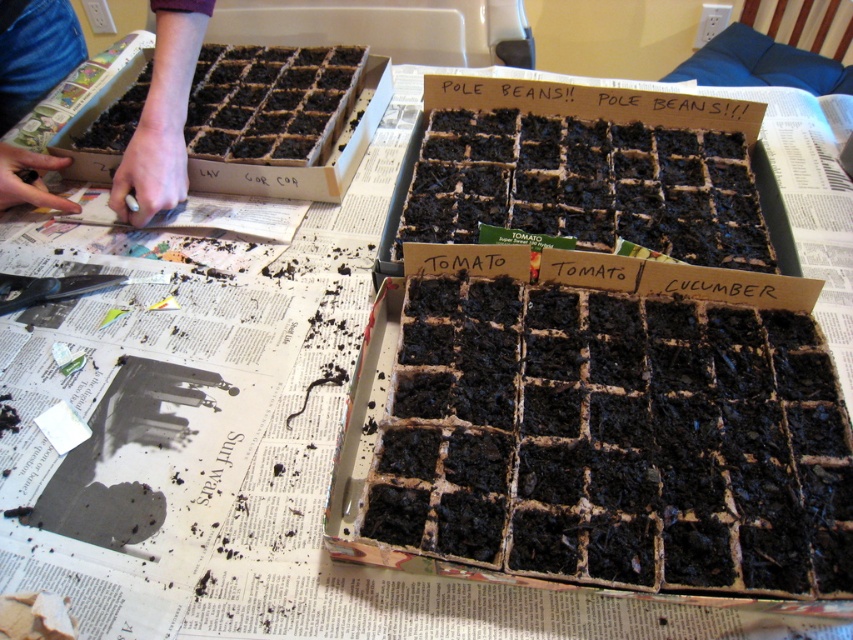
What do you see at coordinates (161, 113) in the screenshot?
I see `smooth skin hand at upper left` at bounding box center [161, 113].

Which of these two, smooth skin hand at upper left or brown cardboard box at upper left, stands taller?

brown cardboard box at upper left

The height and width of the screenshot is (640, 853). What do you see at coordinates (161, 113) in the screenshot?
I see `smooth skin hand at upper left` at bounding box center [161, 113].

Locate an element on the screen. This screenshot has width=853, height=640. smooth skin hand at upper left is located at coordinates (161, 113).